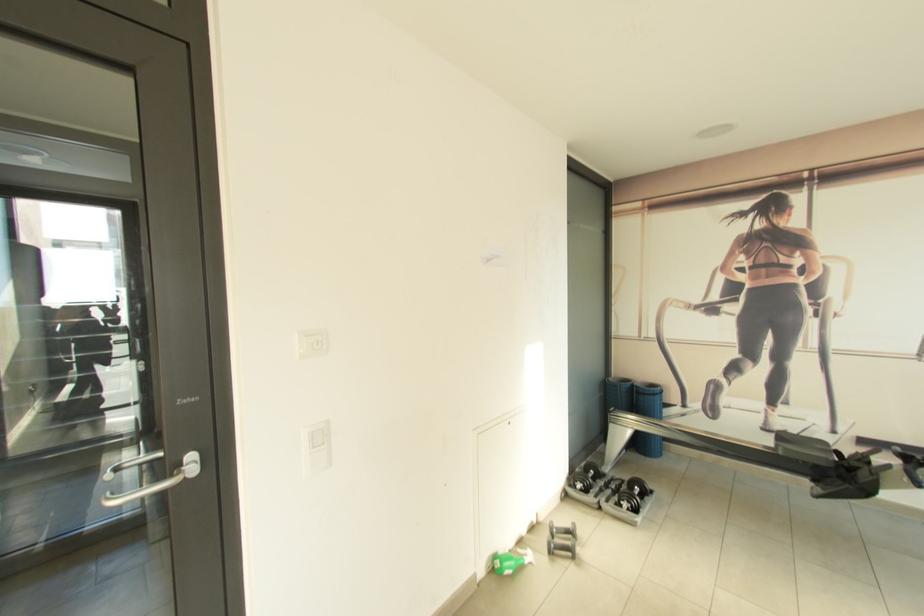
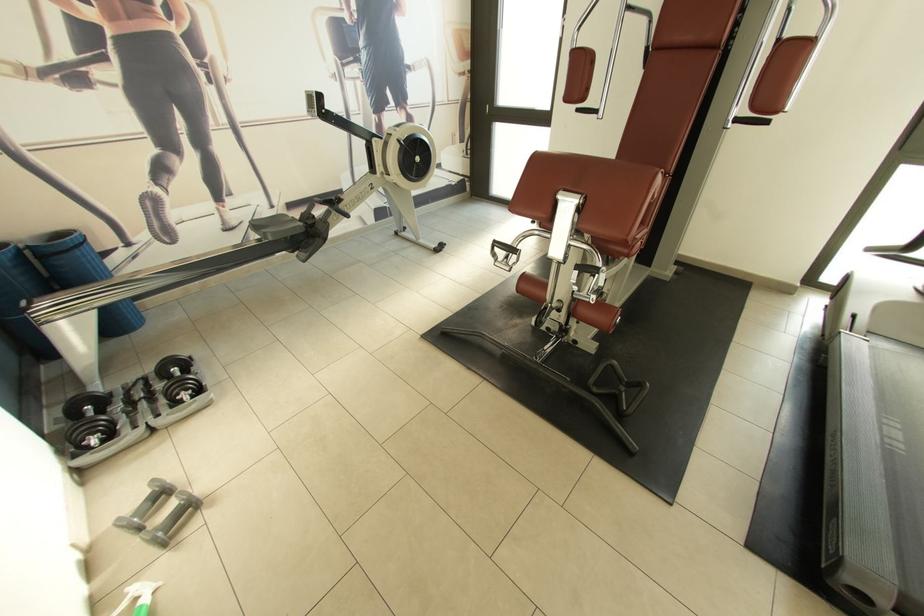
Find the pixel in the second image that matches point (788, 438) in the first image.

(262, 227)